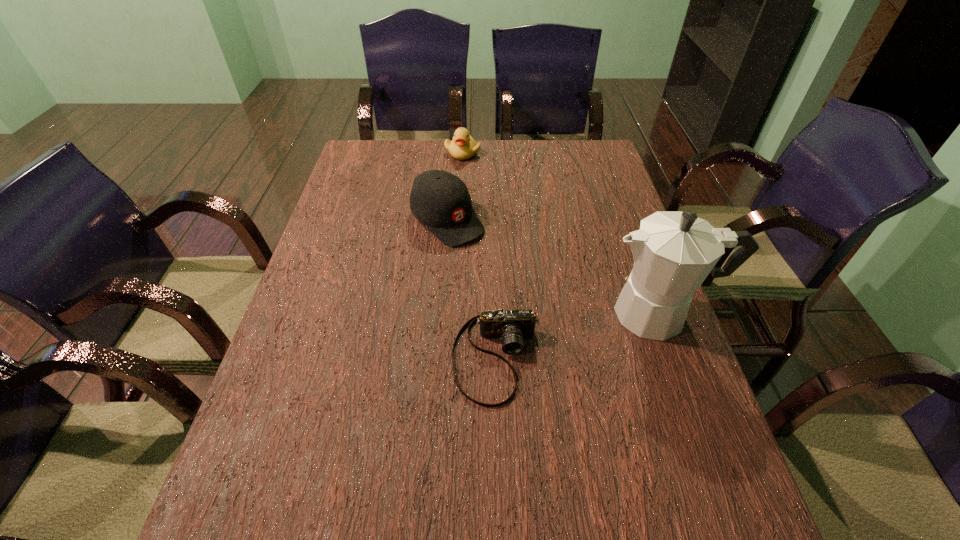
Identify the location of the shortest object. (512, 326).

This screenshot has height=540, width=960. Identify the location of the rightmost object. (674, 251).

At what (x,y) coordinates should I click in order to perform the action: click on the tallest object. Please return your answer as a coordinate pair (x, y). The image size is (960, 540). Looking at the image, I should click on (674, 251).

Locate an element on the screen. duckling is located at coordinates (463, 146).

The height and width of the screenshot is (540, 960). I want to click on the farthest object, so click(x=463, y=146).

The image size is (960, 540). What are the coordinates of `baseball cap` in the screenshot? It's located at [440, 200].

This screenshot has height=540, width=960. I want to click on the second farthest object, so click(440, 200).

In order to click on blank space located on the front-facing side of the shortest object in this screenshot , I will do `click(498, 431)`.

I want to click on vacant point located 0.280m at the spout of the tallest object, so click(486, 313).

At what (x,y) coordinates should I click in order to perform the action: click on vacant space situated at the spout of the tallest object. Please return your answer as a coordinate pair (x, y). Image resolution: width=960 pixels, height=540 pixels. Looking at the image, I should click on (498, 313).